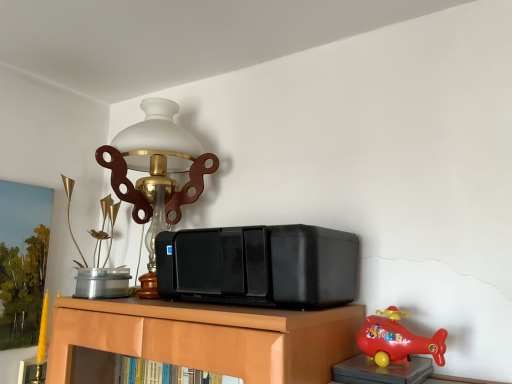
Question: Is matte brass lamp at upper left further to the viewer compared to rubberized red helicopter at lower right, arranged as the 1th toy when viewed from the right?

Choices:
 (A) yes
 (B) no

Answer: (A)

Question: From the image's perspective, is matte brass lamp at upper left over rubberized red helicopter at lower right, the second toy viewed from the back?

Choices:
 (A) yes
 (B) no

Answer: (A)

Question: Is rubberized red helicopter at lower right, arranged as the 1th toy when viewed from the right, at the back of matte brass lamp at upper left?

Choices:
 (A) no
 (B) yes

Answer: (A)

Question: Is matte brass lamp at upper left bigger than rubberized red helicopter at lower right, the second toy viewed from the back?

Choices:
 (A) yes
 (B) no

Answer: (A)

Question: Does matte brass lamp at upper left have a greater width compared to rubberized red helicopter at lower right, arranged as the 1th toy when viewed from the right?

Choices:
 (A) no
 (B) yes

Answer: (B)

Question: Is matte brass lamp at upper left oriented towards rubberized red helicopter at lower right, the second toy viewed from the back?

Choices:
 (A) yes
 (B) no

Answer: (B)

Question: From a real-world perspective, is metallic gold vase at upper left, which appears as the first toy when viewed from the back, on top of black plastic stereo at center?

Choices:
 (A) no
 (B) yes

Answer: (A)

Question: Is the surface of metallic gold vase at upper left, which appears as the first toy when viewed from the back, in direct contact with black plastic stereo at center?

Choices:
 (A) no
 (B) yes

Answer: (A)

Question: Does metallic gold vase at upper left, which is the 1th toy in left-to-right order, have a smaller size compared to black plastic stereo at center?

Choices:
 (A) yes
 (B) no

Answer: (A)

Question: Considering the relative positions of metallic gold vase at upper left, which appears as the first toy when viewed from the back, and black plastic stereo at center in the image provided, is metallic gold vase at upper left, which appears as the first toy when viewed from the back, to the right of black plastic stereo at center from the viewer's perspective?

Choices:
 (A) no
 (B) yes

Answer: (A)

Question: Does metallic gold vase at upper left, the 2th toy from the front, have a greater width compared to black plastic stereo at center?

Choices:
 (A) no
 (B) yes

Answer: (A)

Question: Is metallic gold vase at upper left, which is the 1th toy in left-to-right order, positioned before black plastic stereo at center?

Choices:
 (A) no
 (B) yes

Answer: (A)

Question: From the image's perspective, would you say black plastic stereo at center is shown under rubberized red helicopter at lower right, the first toy when ordered from front to back?

Choices:
 (A) yes
 (B) no

Answer: (B)